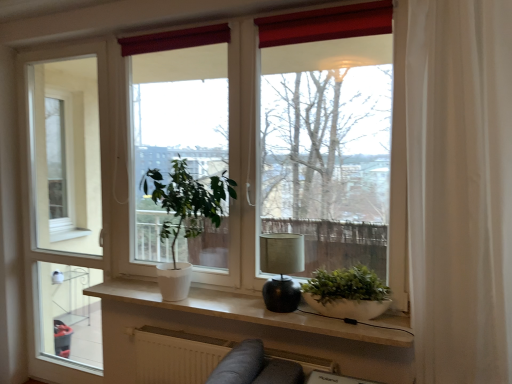
Question: Is white matte window at center facing towards matte black lamp at center?

Choices:
 (A) no
 (B) yes

Answer: (B)

Question: Is white matte window at center not close to matte black lamp at center?

Choices:
 (A) no
 (B) yes

Answer: (A)

Question: Considering the relative sizes of white matte window at center and matte black lamp at center in the image provided, is white matte window at center taller than matte black lamp at center?

Choices:
 (A) no
 (B) yes

Answer: (B)

Question: Is matte black lamp at center a part of white matte window at center?

Choices:
 (A) yes
 (B) no

Answer: (B)

Question: Is white matte window at center further to the viewer compared to matte black lamp at center?

Choices:
 (A) no
 (B) yes

Answer: (A)

Question: Visually, is matte black lamp at center positioned to the left or to the right of green matte plant at center, which appears as the 2th houseplant when viewed from the left?

Choices:
 (A) right
 (B) left

Answer: (B)

Question: Is matte black lamp at center wider or thinner than green matte plant at center, which appears as the 2th houseplant when viewed from the left?

Choices:
 (A) wide
 (B) thin

Answer: (A)

Question: From a real-world perspective, is matte black lamp at center above or below green matte plant at center, which appears as the 2th houseplant when viewed from the left?

Choices:
 (A) below
 (B) above

Answer: (B)

Question: Is matte black lamp at center in front of or behind green matte plant at center, which appears as the first houseplant when viewed from the right, in the image?

Choices:
 (A) behind
 (B) front

Answer: (A)

Question: From the image's perspective, is white matte radiator at lower center located above or below white glossy screen door at left?

Choices:
 (A) below
 (B) above

Answer: (A)

Question: From a real-world perspective, is white matte radiator at lower center physically located above or below white glossy screen door at left?

Choices:
 (A) above
 (B) below

Answer: (B)

Question: From their relative heights in the image, would you say white matte radiator at lower center is taller or shorter than white glossy screen door at left?

Choices:
 (A) tall
 (B) short

Answer: (B)

Question: Considering the relative positions of white matte radiator at lower center and white glossy screen door at left in the image provided, is white matte radiator at lower center to the left or to the right of white glossy screen door at left?

Choices:
 (A) left
 (B) right

Answer: (B)

Question: Would you say white matte radiator at lower center is inside or outside matte black lamp at center?

Choices:
 (A) outside
 (B) inside

Answer: (A)

Question: Is point coord(194,369) positioned closer to the camera than point coord(296,304)?

Choices:
 (A) farther
 (B) closer

Answer: (A)